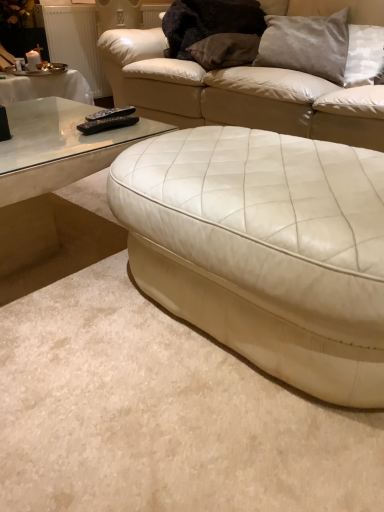
Question: Is black plastic remote at left, which is the second remote in back-to-front order, taller or shorter than transparent glass coffee table at left?

Choices:
 (A) short
 (B) tall

Answer: (A)

Question: Based on their positions, is black plastic remote at left, which is the second remote in back-to-front order, located to the left or right of transparent glass coffee table at left?

Choices:
 (A) right
 (B) left

Answer: (A)

Question: Estimate the real-world distances between objects in this image. Which object is farther from the transparent glass coffee table at left?

Choices:
 (A) white leather studio couch at center, which is the second studio couch in front-to-back order
 (B) black plastic remote at left, which is the second remote in back-to-front order
 (C) white leather ottoman at center, which is the first studio couch in front-to-back order
 (D) suede-like brown pillow at upper center, positioned as the 2th pillow in right-to-left order
 (E) satin gray pillow at upper right, which is counted as the 1th pillow, starting from the right

Answer: (E)

Question: Based on their relative distances, which object is nearer to the white leather studio couch at center, which is the second studio couch in front-to-back order?

Choices:
 (A) white leather ottoman at center, which appears as the second studio couch when viewed from the back
 (B) satin gray pillow at upper right, positioned as the 2th pillow in left-to-right order
 (C) black plastic remote at left, positioned as the 2th remote in front-to-back order
 (D) suede-like brown pillow at upper center, placed as the first pillow when sorted from left to right
 (E) transparent glass coffee table at left

Answer: (D)